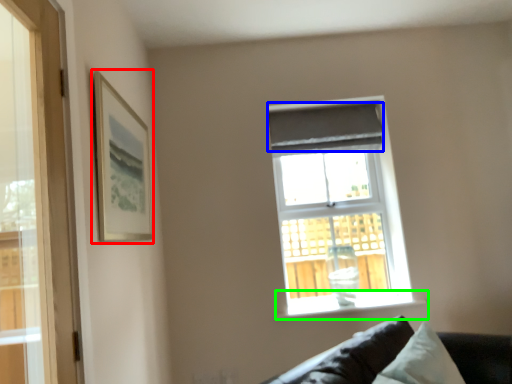
Question: Based on their relative distances, which object is farther from picture frame (highlighted by a red box)? Choose from curtain (highlighted by a blue box) and window sill (highlighted by a green box).

Choices:
 (A) curtain
 (B) window sill

Answer: (B)